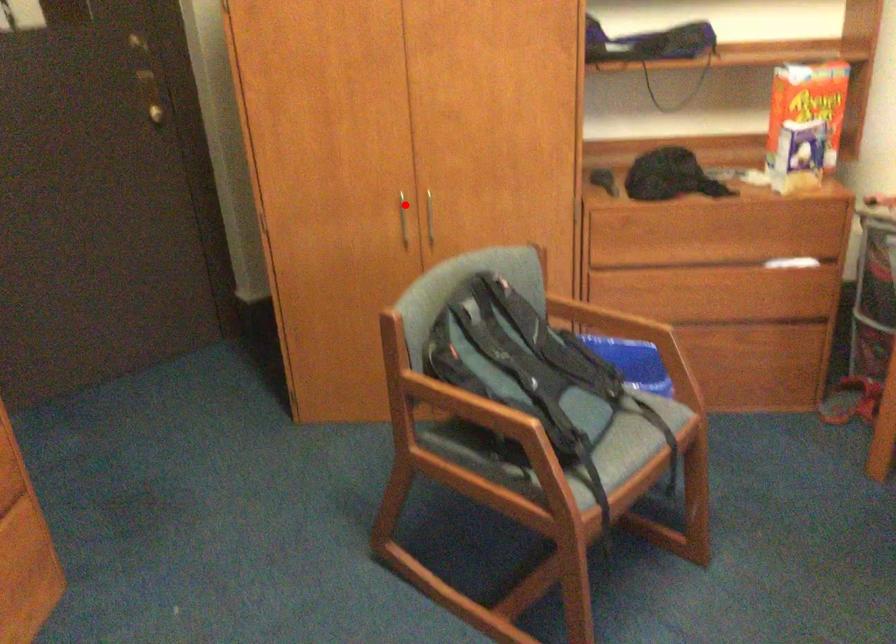
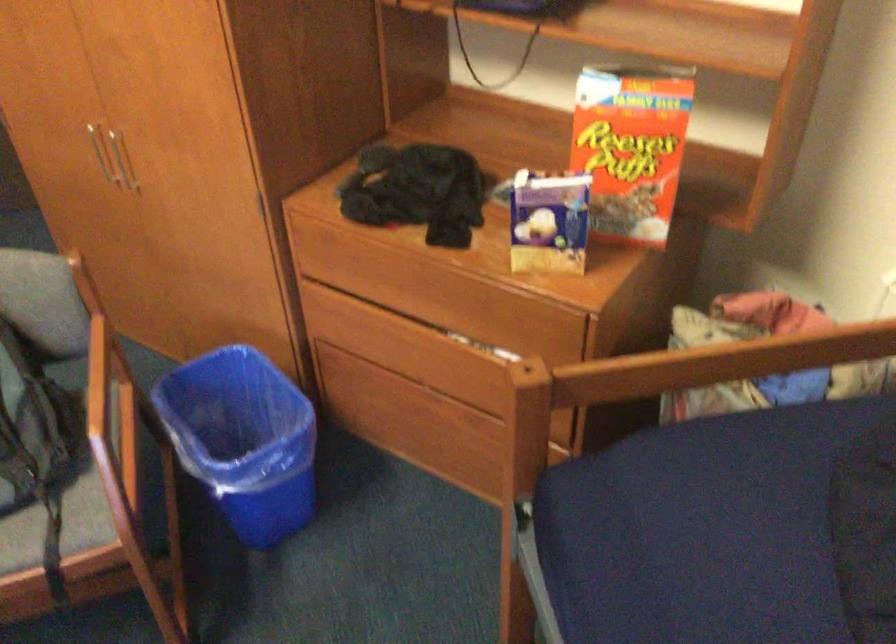
Question: I am providing you with two images of the same scene from different viewpoints. Image1 has a red point marked. In image2, the corresponding 3D location appears at what relative position? Reply with the corresponding letter.

Choices:
 (A) Closer
 (B) Farther

Answer: (A)